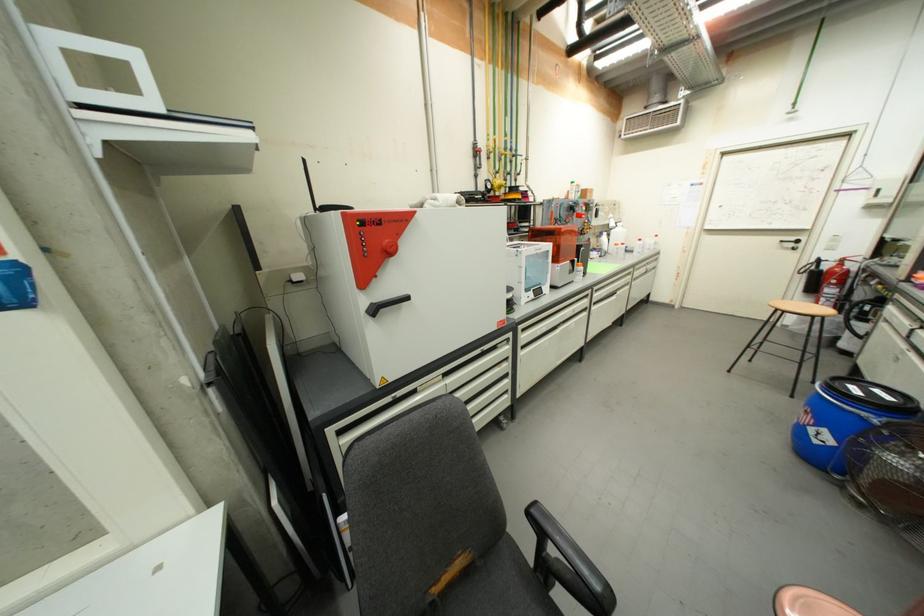
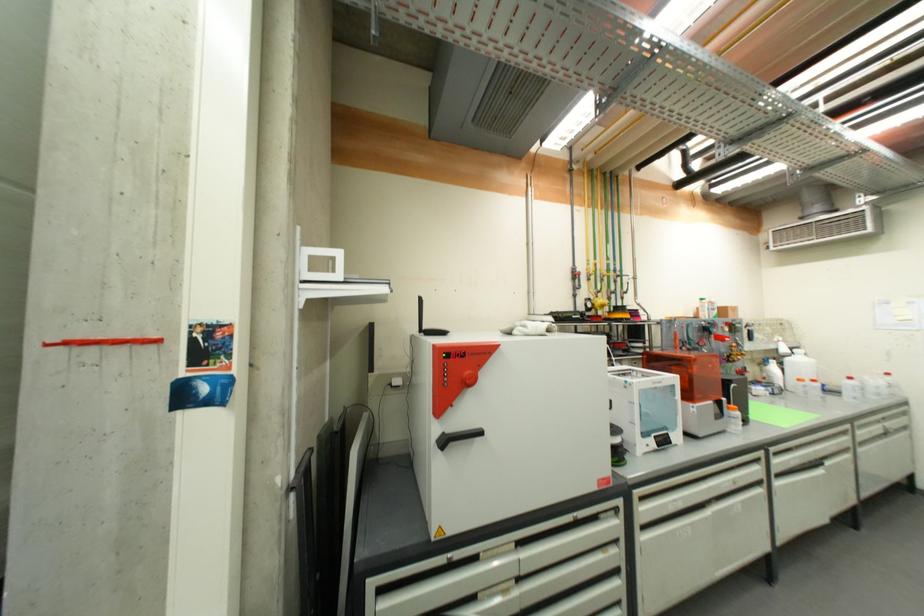
The point at (x=638, y=280) is marked in the first image. Where is the corresponding point in the second image?

(864, 442)